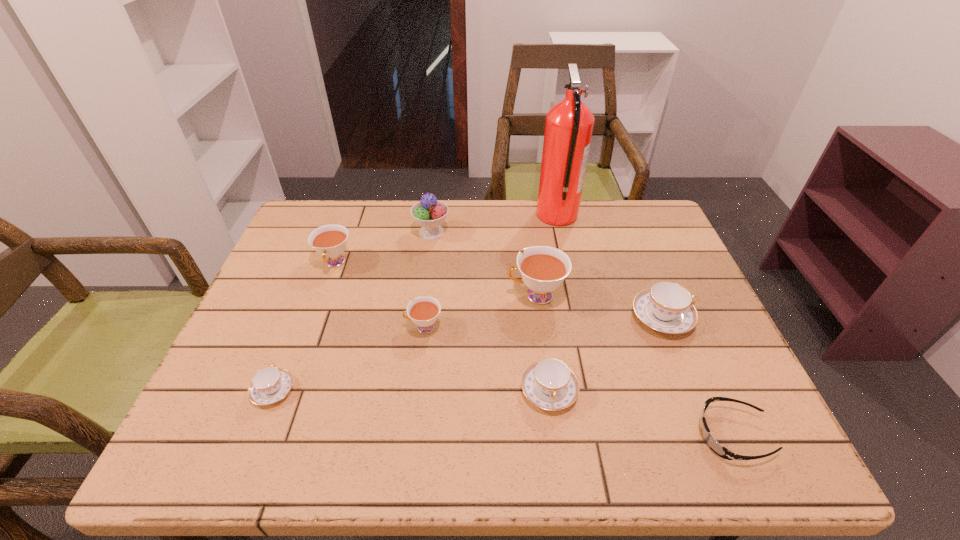
Locate an element on the screen. the second smallest blue teacup is located at coordinates (549, 384).

This screenshot has height=540, width=960. In order to click on the second shortest object in this screenshot , I will do `click(269, 385)`.

Find the location of a particular element. the shortest teacup is located at coordinates (269, 385).

This screenshot has height=540, width=960. Identify the location of sunglasses. (720, 450).

Find the location of a particular element. This screenshot has width=960, height=540. free region located at the nozzle of the tallest object is located at coordinates (461, 215).

You are a GUI agent. You are given a task and a screenshot of the screen. Output one action in this format:
    pyautogui.click(x=<x>, y=<y>)
    Task: Click on the free region located at the nozzle of the tallest object
    This screenshot has height=540, width=960.
    Given the screenshot: What is the action you would take?
    pyautogui.click(x=444, y=215)

Locate an element on the screen. The height and width of the screenshot is (540, 960). free spot located at the nozzle of the tallest object is located at coordinates (498, 215).

Where is `vacant space located 0.400m on the right of the icecream`? This screenshot has width=960, height=540. vacant space located 0.400m on the right of the icecream is located at coordinates pos(583,232).

This screenshot has width=960, height=540. I want to click on free space located on the side of the rightmost white teacup with the handle, so click(472, 295).

You are a GUI agent. You are given a task and a screenshot of the screen. Output one action in this format:
    pyautogui.click(x=<x>, y=<y>)
    Task: Click on the vacant space located on the side of the rightmost white teacup with the handle
    
    Given the screenshot: What is the action you would take?
    pyautogui.click(x=456, y=295)